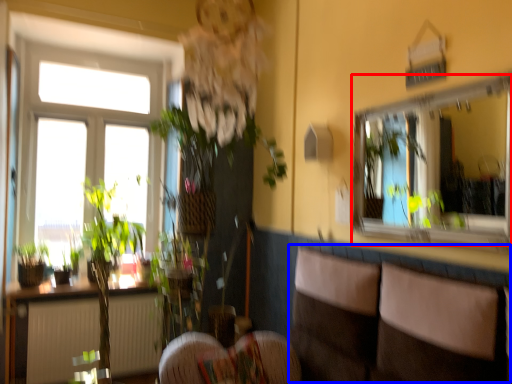
Question: Which point is further to the camera, mirror (highlighted by a red box) or couch (highlighted by a blue box)?

Choices:
 (A) mirror
 (B) couch

Answer: (A)